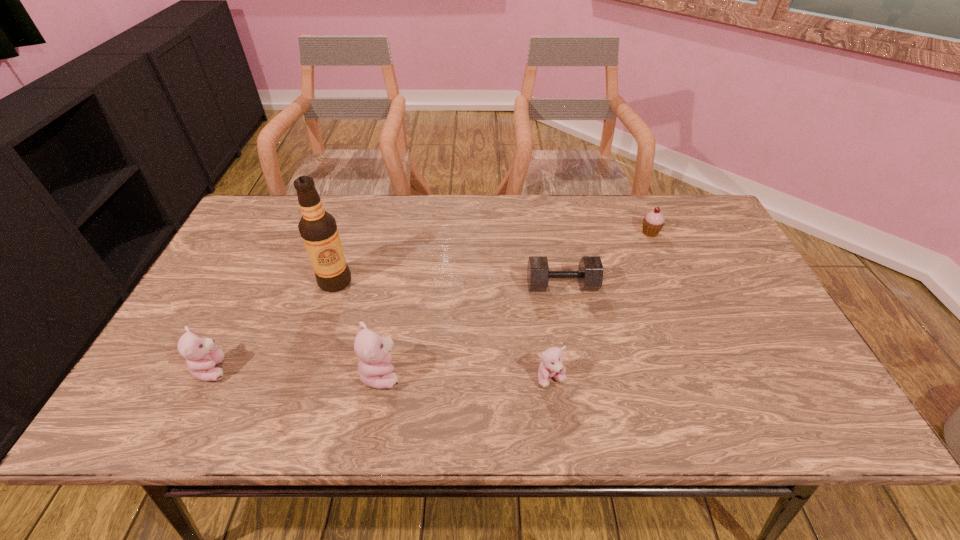
You are a GUI agent. You are given a task and a screenshot of the screen. Output one action in this format:
    pyautogui.click(x=<x>, y=<y>)
    Task: Click on the vacant space at the left edge
    
    Given the screenshot: What is the action you would take?
    pyautogui.click(x=246, y=305)

Image resolution: width=960 pixels, height=540 pixels. What are the coordinates of `free region at the right edge of the desktop` in the screenshot? It's located at [768, 324].

The width and height of the screenshot is (960, 540). In the image, there is a desktop. What are the coordinates of `vacant space at the far left corner` in the screenshot? It's located at (292, 217).

Locate an element on the screen. This screenshot has height=540, width=960. free space at the far right corner is located at coordinates (679, 238).

Identify the location of free space between the second teddy bear from left to right and the cupcake. (516, 303).

You are a GUI agent. You are given a task and a screenshot of the screen. Output one action in this format:
    pyautogui.click(x=<x>, y=<y>)
    Task: Click on the unoccupied position between the fifth object from right to left and the tallest teddy bear
    The height and width of the screenshot is (540, 960).
    Given the screenshot: What is the action you would take?
    click(x=358, y=327)

The width and height of the screenshot is (960, 540). I want to click on vacant point located between the dumbbell and the leftmost teddy bear, so click(388, 327).

Locate an element on the screen. vacant point located between the tallest object and the farthest object is located at coordinates (492, 257).

Identify the location of free space between the third tallest object and the fifth shortest object. The height and width of the screenshot is (540, 960). (298, 371).

In order to click on unoccupied area between the rightmost teddy bear and the rightmost object in this screenshot , I will do `click(601, 306)`.